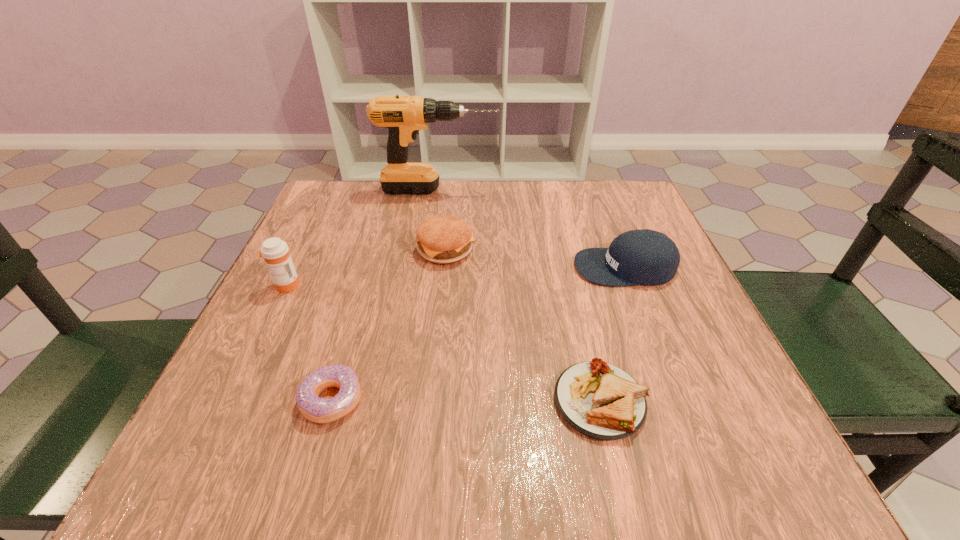
Where is `vacant area between the sandwich and the tallest object`? The image size is (960, 540). vacant area between the sandwich and the tallest object is located at coordinates (519, 295).

Locate an element on the screen. The image size is (960, 540). free space between the baseball cap and the doughnut is located at coordinates (478, 333).

Locate which object is the second closest to the baseball cap. Please provide its 2D coordinates. Your answer should be formatted as a tuple, i.e. [(x, y)], where the tuple contains the x and y coordinates of a point satisfying the conditions above.

[(443, 239)]

Point out which object is positioned as the third nearest to the farthest object. Please provide its 2D coordinates. Your answer should be formatted as a tuple, i.e. [(x, y)], where the tuple contains the x and y coordinates of a point satisfying the conditions above.

[(275, 252)]

Where is `vacant space that satisfies the following two spatial constraints: 1. on the back side of the hamburger; 2. at the tip of the tallest object`? vacant space that satisfies the following two spatial constraints: 1. on the back side of the hamburger; 2. at the tip of the tallest object is located at coordinates (451, 190).

The width and height of the screenshot is (960, 540). In order to click on blank space that satisfies the following two spatial constraints: 1. at the tip of the sandwich; 2. on the left side of the farthest object in this screenshot , I will do `click(410, 401)`.

This screenshot has height=540, width=960. Identify the location of blank area in the image that satisfies the following two spatial constraints: 1. on the back side of the doughnut; 2. on the left side of the hamburger. (375, 249).

The image size is (960, 540). What are the coordinates of `free space that satisfies the following two spatial constraints: 1. on the front side of the leftmost object; 2. on the left side of the doughnut` in the screenshot? It's located at (229, 400).